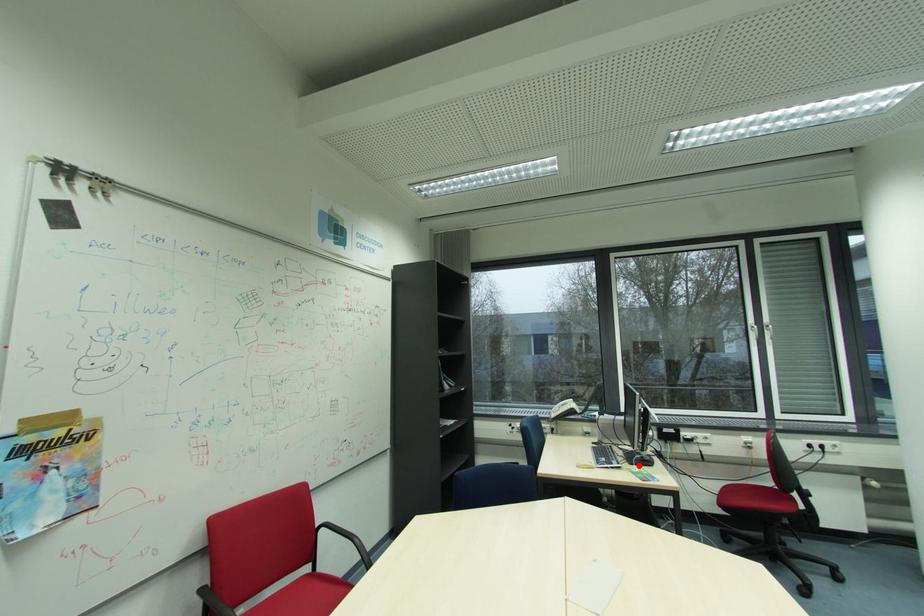
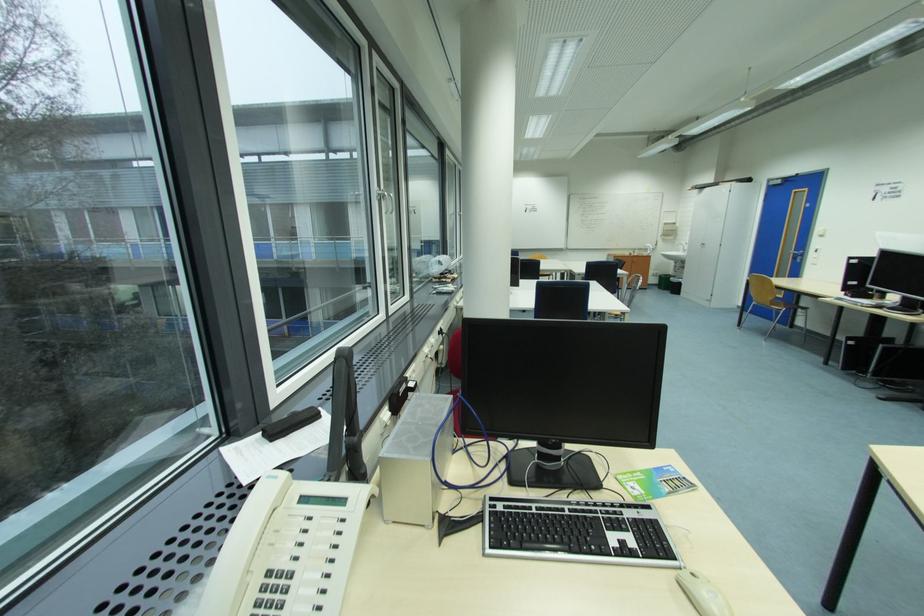
Question: I am providing you with two images of the same scene from different viewpoints. A red point is marked on the first image. At the location where the point appears in image 1, is it still visible in image 2?

Choices:
 (A) Yes
 (B) No

Answer: (B)